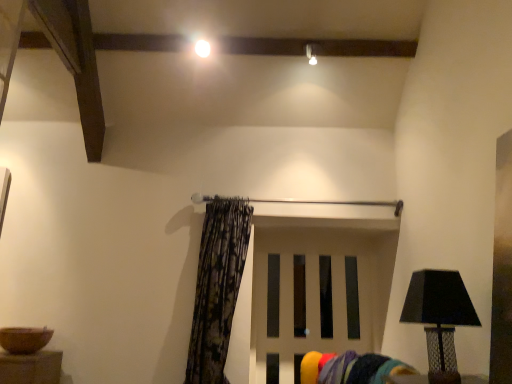
Question: Considering the positions of point (198, 41) and point (236, 210), is point (198, 41) closer or farther from the camera than point (236, 210)?

Choices:
 (A) farther
 (B) closer

Answer: (B)

Question: Is white glossy light bulb at upper center in front of or behind printed fabric curtain at center in the image?

Choices:
 (A) behind
 (B) front

Answer: (A)

Question: Which of these objects is positioned closest to the printed fabric curtain at center?

Choices:
 (A) white matte door at center
 (B) white glossy light bulb at upper center
 (C) velvet yellow swivel chair at lower center
 (D) black textured lamp at right

Answer: (C)

Question: Which of these objects is positioned farthest from the printed fabric curtain at center?

Choices:
 (A) black textured lamp at right
 (B) white matte door at center
 (C) white glossy light bulb at upper center
 (D) velvet yellow swivel chair at lower center

Answer: (C)